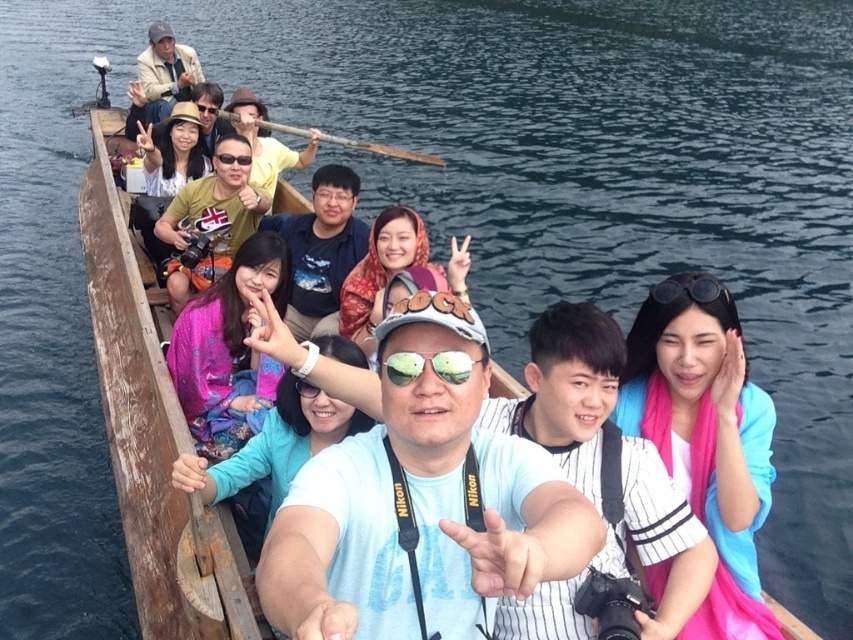
Question: Considering the real-world distances, which object is closest to the reflective plastic goggles at center?

Choices:
 (A) wooden at center
 (B) matte black goggles at center
 (C) matte pink scarf at center
 (D) matte yellow hat at center

Answer: (C)

Question: Which is farther from the matte black goggles at center?

Choices:
 (A) black rubber goggles at upper center
 (B) matte yellow hat at center
 (C) matte black sunglasses at upper center
 (D) matte black camera at center

Answer: (A)

Question: Does black rubber goggles at upper center appear on the left side of matte black goggles at center?

Choices:
 (A) yes
 (B) no

Answer: (B)

Question: Which of the following is the farthest from the observer?

Choices:
 (A) matte black sunglasses at upper center
 (B) blue fabric at center
 (C) black rubber goggles at upper center

Answer: (A)

Question: In this image, where is black rubber goggles at upper center located relative to matte black sunglasses at upper center?

Choices:
 (A) left
 (B) right

Answer: (B)

Question: Is matte black camera at center above wooden at center?

Choices:
 (A) yes
 (B) no

Answer: (B)